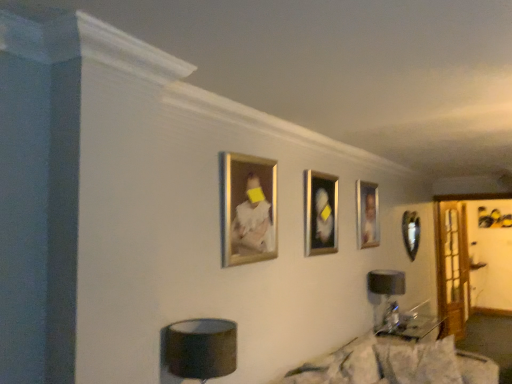
This screenshot has height=384, width=512. Describe the element at coordinates (367, 215) in the screenshot. I see `gold-framed portrait at center, the second picture frame from the right` at that location.

How much space does gold metallic picture frame at upper center, the fourth picture frame when ordered from back to front, occupy horizontally?

It is 6.53 centimeters.

Find the location of a particular element. The width and height of the screenshot is (512, 384). white textured pillow at lower right, placed as the second pillow when sorted from left to right is located at coordinates (419, 362).

Considering the sizes of objects fluffy white pillow at lower center, which appears as the first pillow when viewed from the left, and metallic silver picture frame at right, which is the 1th picture frame from back to front, in the image provided, who is shorter, fluffy white pillow at lower center, which appears as the first pillow when viewed from the left, or metallic silver picture frame at right, which is the 1th picture frame from back to front,?

fluffy white pillow at lower center, which appears as the first pillow when viewed from the left.

Does fluffy white pillow at lower center, which appears as the first pillow when viewed from the left, turn towards metallic silver picture frame at right, which appears as the first picture frame when viewed from the right?

No, fluffy white pillow at lower center, which appears as the first pillow when viewed from the left, does not turn towards metallic silver picture frame at right, which appears as the first picture frame when viewed from the right.

From a real-world perspective, who is located higher, fluffy white pillow at lower center, the 2th pillow viewed from the right, or metallic silver picture frame at right, which is the 1th picture frame from back to front?

metallic silver picture frame at right, which is the 1th picture frame from back to front, from a real-world perspective.

Is fluffy white pillow at lower center, the 2th pillow viewed from the right, beside metallic silver picture frame at right, which is the 1th picture frame from back to front?

They are not placed beside each other.

From the image's perspective, is gold-framed portrait at center, which is the 3th picture frame from front to back, over fluffy white couch at lower right?

Yes, from the image's perspective, gold-framed portrait at center, which is the 3th picture frame from front to back, is above fluffy white couch at lower right.

Considering the sizes of objects gold-framed portrait at center, placed as the third picture frame when sorted from left to right, and fluffy white couch at lower right in the image provided, who is taller, gold-framed portrait at center, placed as the third picture frame when sorted from left to right, or fluffy white couch at lower right?

gold-framed portrait at center, placed as the third picture frame when sorted from left to right.

Is gold-framed portrait at center, which is the 3th picture frame from front to back, placed right next to fluffy white couch at lower right?

No, gold-framed portrait at center, which is the 3th picture frame from front to back, is not touching fluffy white couch at lower right.

Is gold-framed portrait at center, which is the 3th picture frame from front to back, to the right of fluffy white couch at lower right from the viewer's perspective?

Yes, gold-framed portrait at center, which is the 3th picture frame from front to back, is to the right of fluffy white couch at lower right.

Who is smaller, fluffy white pillow at lower center, the 2th pillow viewed from the right, or black fabric table lamp at lower right, marked as the 2th table lamp in a front-to-back arrangement?

With smaller size is black fabric table lamp at lower right, marked as the 2th table lamp in a front-to-back arrangement.

Is fluffy white pillow at lower center, which appears as the first pillow when viewed from the left, taller or shorter than black fabric table lamp at lower right, marked as the 2th table lamp in a front-to-back arrangement?

In the image, fluffy white pillow at lower center, which appears as the first pillow when viewed from the left, appears to be shorter than black fabric table lamp at lower right, marked as the 2th table lamp in a front-to-back arrangement.

Based on the photo, which is closer to the camera, (368, 378) or (397, 305)?

The point (368, 378) is more forward.

From a real-world perspective, who is located higher, fluffy white pillow at lower center, which appears as the first pillow when viewed from the left, or black fabric table lamp at lower right, the 2th table lamp when ordered from left to right?

black fabric table lamp at lower right, the 2th table lamp when ordered from left to right.

Is point (373, 290) behind point (253, 197)?

That is True.

Is black fabric table lamp at lower right, which ranks as the first table lamp in right-to-left order, turned away from gold metallic picture frame at upper center, placed as the first picture frame when sorted from front to back?

black fabric table lamp at lower right, which ranks as the first table lamp in right-to-left order, does not have its back to gold metallic picture frame at upper center, placed as the first picture frame when sorted from front to back.

Is black fabric table lamp at lower right, which ranks as the first table lamp in right-to-left order, inside or outside of gold metallic picture frame at upper center, which appears as the first picture frame when viewed from the left?

black fabric table lamp at lower right, which ranks as the first table lamp in right-to-left order, is spatially situated outside gold metallic picture frame at upper center, which appears as the first picture frame when viewed from the left.

Between fluffy white couch at lower right and white textured pillow at lower right, acting as the first pillow starting from the right, which one appears on the right side from the viewer's perspective?

white textured pillow at lower right, acting as the first pillow starting from the right.

From the image's perspective, which is above, fluffy white couch at lower right or white textured pillow at lower right, placed as the second pillow when sorted from left to right?

fluffy white couch at lower right appears higher in the image.

Would you say fluffy white couch at lower right is outside white textured pillow at lower right, placed as the second pillow when sorted from left to right?

That's correct, fluffy white couch at lower right is outside of white textured pillow at lower right, placed as the second pillow when sorted from left to right.

Consider the image. Considering the positions of objects fluffy white couch at lower right and white textured pillow at lower right, acting as the first pillow starting from the right, in the image provided, who is behind, fluffy white couch at lower right or white textured pillow at lower right, acting as the first pillow starting from the right,?

white textured pillow at lower right, acting as the first pillow starting from the right.

Who is bigger, matte black lampshade at lower center, which is counted as the second table lamp, starting from the right, or fluffy white couch at lower right?

fluffy white couch at lower right is bigger.

From the image's perspective, does matte black lampshade at lower center, the 1th table lamp positioned from the front, appear higher than fluffy white couch at lower right?

Yes.

Is there a large distance between matte black lampshade at lower center, the second table lamp in the back-to-front sequence, and fluffy white couch at lower right?

matte black lampshade at lower center, the second table lamp in the back-to-front sequence, is far away from fluffy white couch at lower right.

Who is more distant, matte black lampshade at lower center, positioned as the first table lamp in left-to-right order, or fluffy white couch at lower right?

matte black lampshade at lower center, positioned as the first table lamp in left-to-right order, is further from the camera.

Which point is more forward, (387, 324) or (456, 378)?

The point (456, 378) is in front.

Starting from the black fabric table lamp at lower right, which is the 1th table lamp from back to front, which pillow is the 1st one in front? Please provide its 2D coordinates.

[(419, 362)]

Do you think black fabric table lamp at lower right, which is the 1th table lamp from back to front, is within white textured pillow at lower right, acting as the first pillow starting from the right, or outside of it?

black fabric table lamp at lower right, which is the 1th table lamp from back to front, is outside white textured pillow at lower right, acting as the first pillow starting from the right.

Could you tell me if black fabric table lamp at lower right, marked as the 2th table lamp in a front-to-back arrangement, is facing white textured pillow at lower right, placed as the second pillow when sorted from left to right?

No, black fabric table lamp at lower right, marked as the 2th table lamp in a front-to-back arrangement, is not oriented towards white textured pillow at lower right, placed as the second pillow when sorted from left to right.

Identify the location of the 2nd pillow to the left of the metallic silver picture frame at right, which is the 1th picture frame from back to front, counting from the anchor's position. The width and height of the screenshot is (512, 384). (355, 363).

Where is `the 3rd picture frame behind when counting from the fluffy white couch at lower right`? The width and height of the screenshot is (512, 384). the 3rd picture frame behind when counting from the fluffy white couch at lower right is located at coordinates (367, 215).

Based on their spatial positions, is metallic silver picture frame at right, which appears as the first picture frame when viewed from the right, or clear glass door at right closer to white textured pillow at lower right, acting as the first pillow starting from the right?

Based on the image, metallic silver picture frame at right, which appears as the first picture frame when viewed from the right, appears to be nearer to white textured pillow at lower right, acting as the first pillow starting from the right.

Considering their positions, is gold-framed portrait at center, placed as the third picture frame when sorted from left to right, positioned closer to clear glass door at right than metallic silver picture frame at center, positioned as the 3th picture frame in right-to-left order?

Among the two, gold-framed portrait at center, placed as the third picture frame when sorted from left to right, is located nearer to clear glass door at right.

When comparing their distances from gold metallic picture frame at upper center, the fourth picture frame when ordered from back to front, does metallic silver picture frame at center, which is counted as the 2th picture frame, starting from the left, or white textured pillow at lower right, acting as the first pillow starting from the right, seem further?

white textured pillow at lower right, acting as the first pillow starting from the right, lies further to gold metallic picture frame at upper center, the fourth picture frame when ordered from back to front, than the other object.

Considering their positions, is gold-framed portrait at center, marked as the second picture frame in a back-to-front arrangement, positioned further to fluffy white pillow at lower center, which appears as the first pillow when viewed from the left, than white textured pillow at lower right, acting as the first pillow starting from the right?

gold-framed portrait at center, marked as the second picture frame in a back-to-front arrangement.

Estimate the real-world distances between objects in this image. Which object is further from fluffy white couch at lower right, fluffy white pillow at lower center, the 2th pillow viewed from the right, or clear glass door at right?

clear glass door at right is positioned further to the anchor fluffy white couch at lower right.

Considering their positions, is metallic silver picture frame at center, marked as the 3th picture frame in a back-to-front arrangement, positioned further to gold-framed portrait at center, placed as the third picture frame when sorted from left to right, than gold metallic picture frame at upper center, placed as the first picture frame when sorted from front to back?

gold metallic picture frame at upper center, placed as the first picture frame when sorted from front to back, is further to gold-framed portrait at center, placed as the third picture frame when sorted from left to right.

Looking at the image, which one is located further to fluffy white pillow at lower center, which appears as the first pillow when viewed from the left, white textured pillow at lower right, acting as the first pillow starting from the right, or gold metallic picture frame at upper center, which appears as the first picture frame when viewed from the left?

gold metallic picture frame at upper center, which appears as the first picture frame when viewed from the left, is positioned further to the anchor fluffy white pillow at lower center, which appears as the first pillow when viewed from the left.

When comparing their distances from metallic silver picture frame at center, positioned as the 3th picture frame in right-to-left order, does metallic silver picture frame at right, which is the fourth picture frame in front-to-back order, or matte black lampshade at lower center, the second table lamp in the back-to-front sequence, seem further?

metallic silver picture frame at right, which is the fourth picture frame in front-to-back order, lies further to metallic silver picture frame at center, positioned as the 3th picture frame in right-to-left order, than the other object.

Identify the location of table lamp located between fluffy white pillow at lower center, the 2th pillow viewed from the right, and clear glass door at right in the depth direction. The image size is (512, 384). (388, 293).

Locate an element on the screen. The height and width of the screenshot is (384, 512). table lamp located between metallic silver picture frame at center, which is counted as the 2th picture frame, starting from the left, and metallic silver picture frame at right, which is the fourth picture frame in front-to-back order, in the depth direction is located at coordinates (388, 293).

Identify the location of table lamp positioned between white textured pillow at lower right, acting as the first pillow starting from the right, and clear glass door at right from near to far. The width and height of the screenshot is (512, 384). (388, 293).

The height and width of the screenshot is (384, 512). I want to click on table lamp between fluffy white pillow at lower center, the 2th pillow viewed from the right, and gold-framed portrait at center, the second picture frame from the right, in the front-back direction, so click(388, 293).